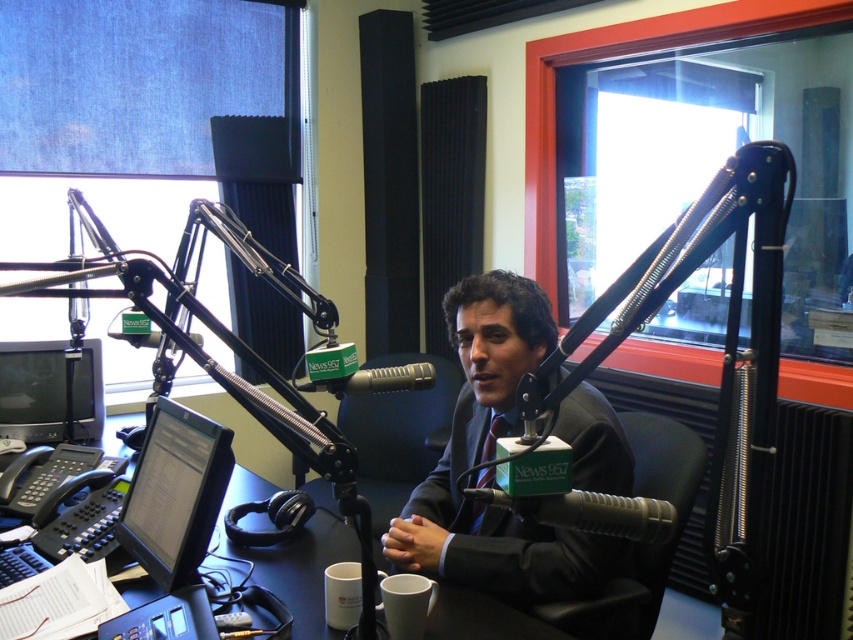
You are an assistant in the radio studio. You need to place a stack of papers that is 10 cm tall on the surface of either the matte black monitor at left or the black plastic table at center. Which surface can safely accommodate the stack without it exceeding the height of the other object?

The matte black monitor at left has a greater height compared to the black plastic table at center. Therefore, placing the stack of papers on the matte black monitor at left would not exceed its own height, but placing it on the black plastic table at center might cause the total height to surpass the monitor. However, since the question asks which surface can safely accommodate without exceeding the other object, the correct choice is the black plastic table at center because the monitor is taller, so the